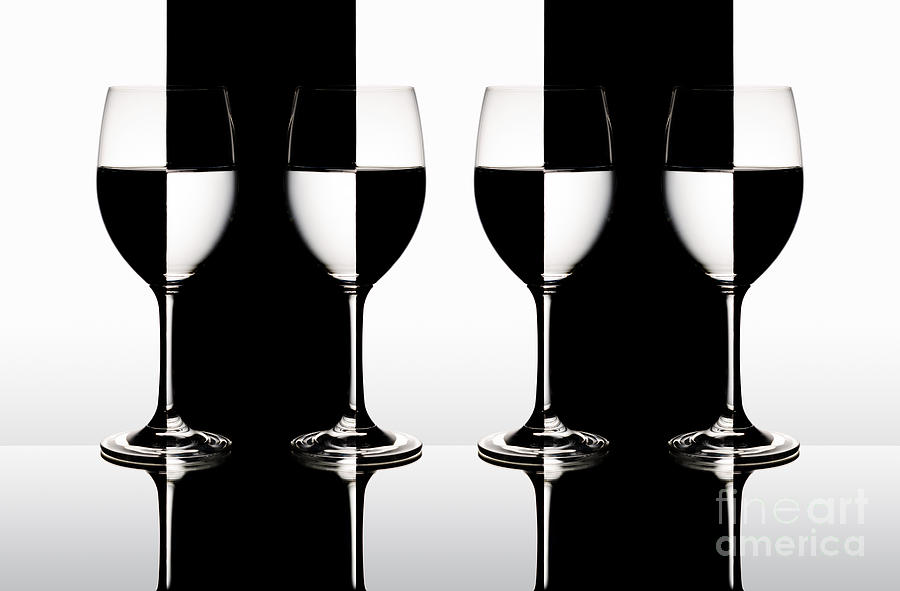
Find the location of `wine glasses`. wine glasses is located at coordinates (177, 199), (358, 191), (542, 198), (736, 209).